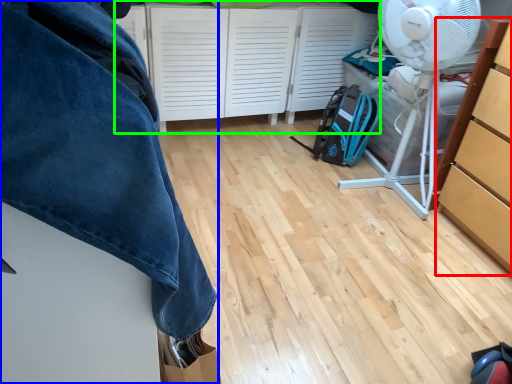
Question: Which object is positioned closest to cabinetry (highlighted by a red box)? Select from furniture (highlighted by a blue box) and cabinetry (highlighted by a green box).

Choices:
 (A) furniture
 (B) cabinetry

Answer: (B)